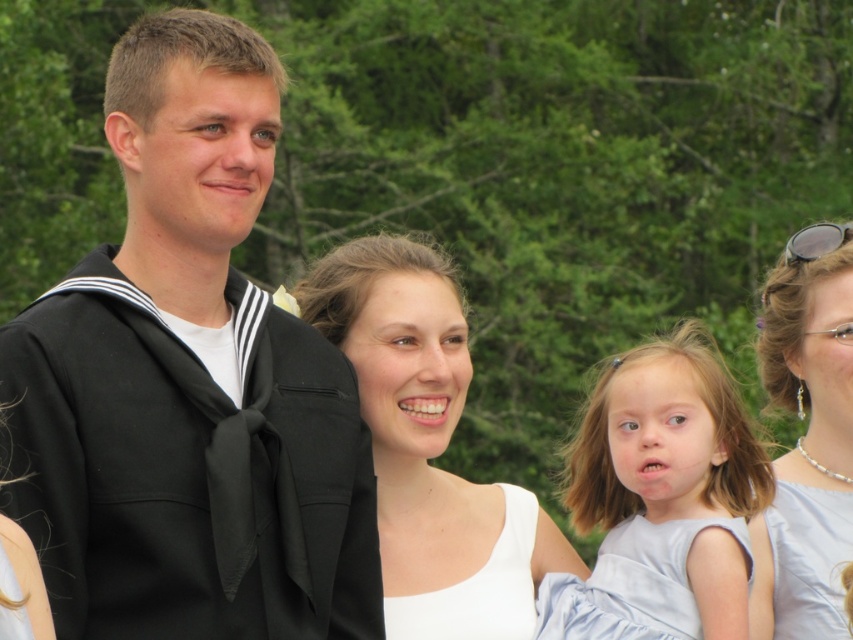
Can you confirm if pearl necklace at upper right is positioned above sunglasses at upper right?

No, pearl necklace at upper right is not above sunglasses at upper right.

Between pearl necklace at upper right and sunglasses at upper right, which one has less height?

sunglasses at upper right

Identify the location of pearl necklace at upper right. (807, 436).

Is pearl necklace at upper right to the left of white satin dress at lower right from the viewer's perspective?

Incorrect, pearl necklace at upper right is not on the left side of white satin dress at lower right.

At what (x,y) coordinates should I click in order to perform the action: click on pearl necklace at upper right. Please return your answer as a coordinate pair (x, y). Looking at the image, I should click on (807, 436).

Which is more to the left, white matte tank top at center or sunglasses at upper right?

From the viewer's perspective, white matte tank top at center appears more on the left side.

Which is in front, point (439, 600) or point (791, 259)?

Point (439, 600) is more forward.

Which is in front, point (505, 484) or point (804, 244)?

Point (505, 484) is more forward.

Find the location of `white matte tank top at center`. white matte tank top at center is located at coordinates (479, 588).